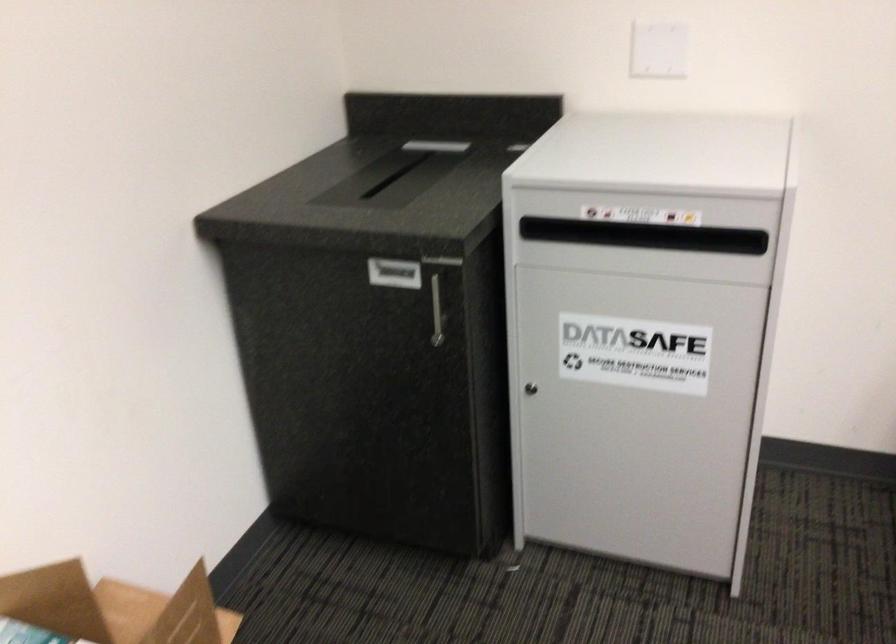
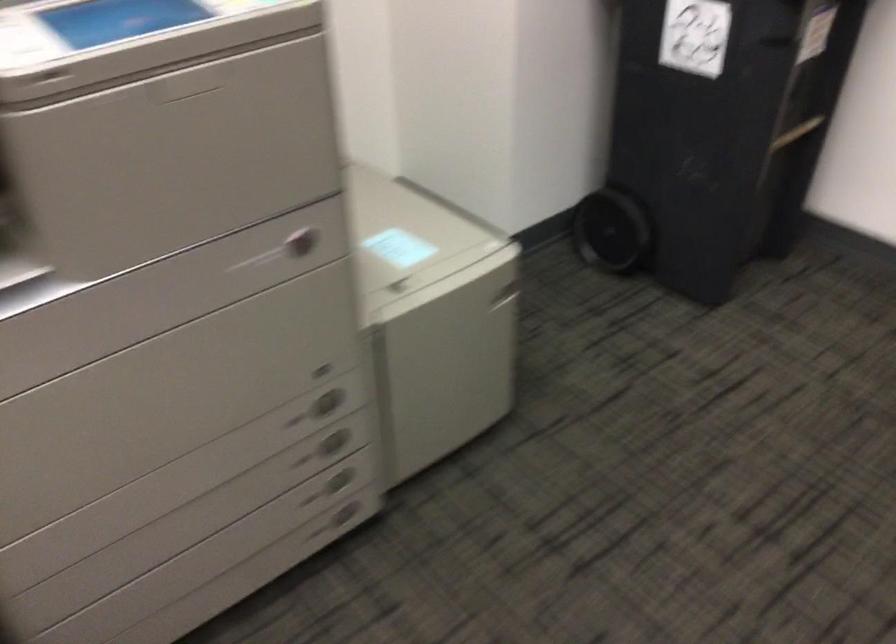
Looking at this image, how did the camera likely rotate?

The camera's rotation is toward right-down.